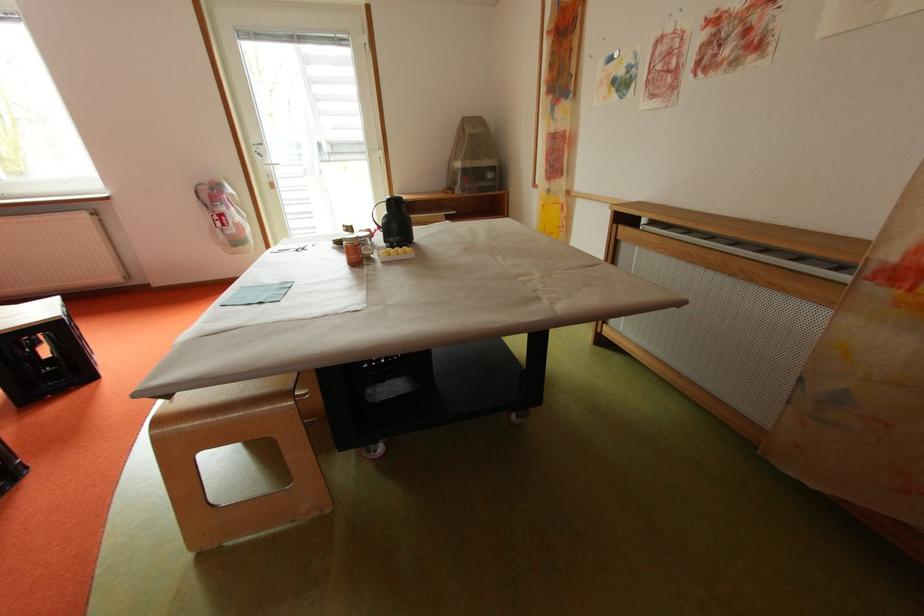
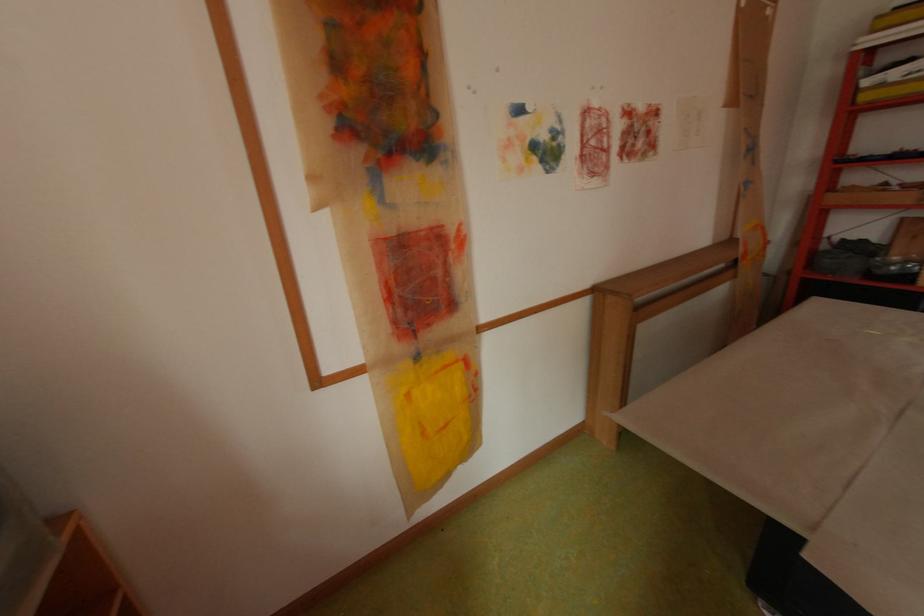
In the second image, find the point that corresponds to [558,191] in the first image.

(429, 358)